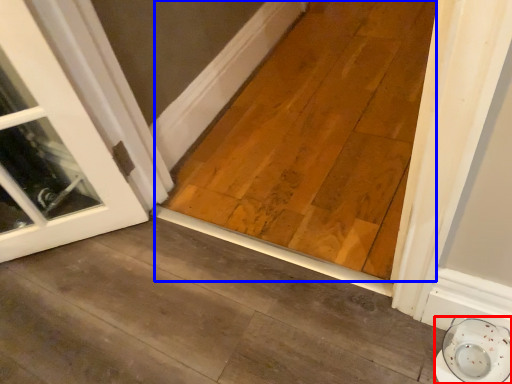
Question: Among these objects, which one is nearest to the camera, saucer (highlighted by a red box) or plank (highlighted by a blue box)?

Choices:
 (A) saucer
 (B) plank

Answer: (A)